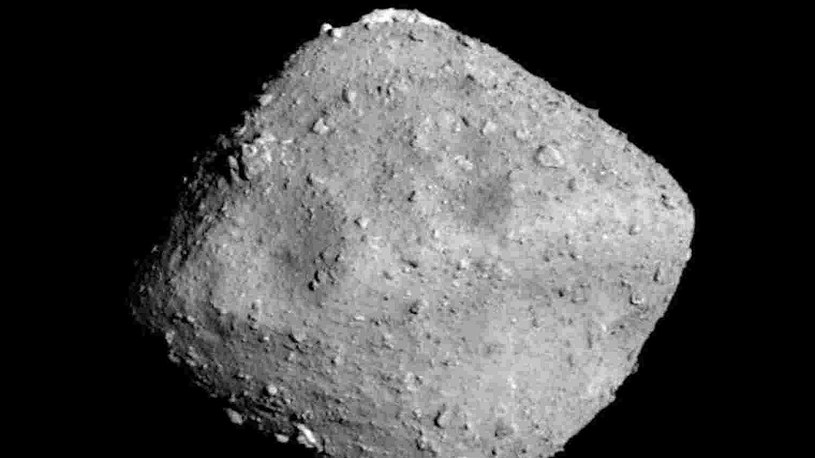
At what (x,y) coordinates should I click in order to perform the action: click on corner. Please return your answer as a coordinate pair (x, y). Looking at the image, I should click on (421, 76).